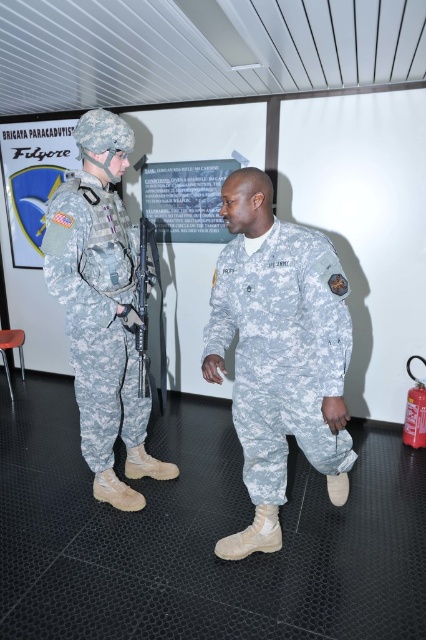
Is camouflage fabric uniform at center behind camouflage fabric uniform at left?

No, it is in front of camouflage fabric uniform at left.

Between camouflage fabric uniform at center and camouflage fabric uniform at left, which one has more height?

With more height is camouflage fabric uniform at left.

What do you see at coordinates (282, 349) in the screenshot? Image resolution: width=426 pixels, height=640 pixels. I see `camouflage fabric uniform at center` at bounding box center [282, 349].

I want to click on camouflage fabric uniform at center, so click(x=282, y=349).